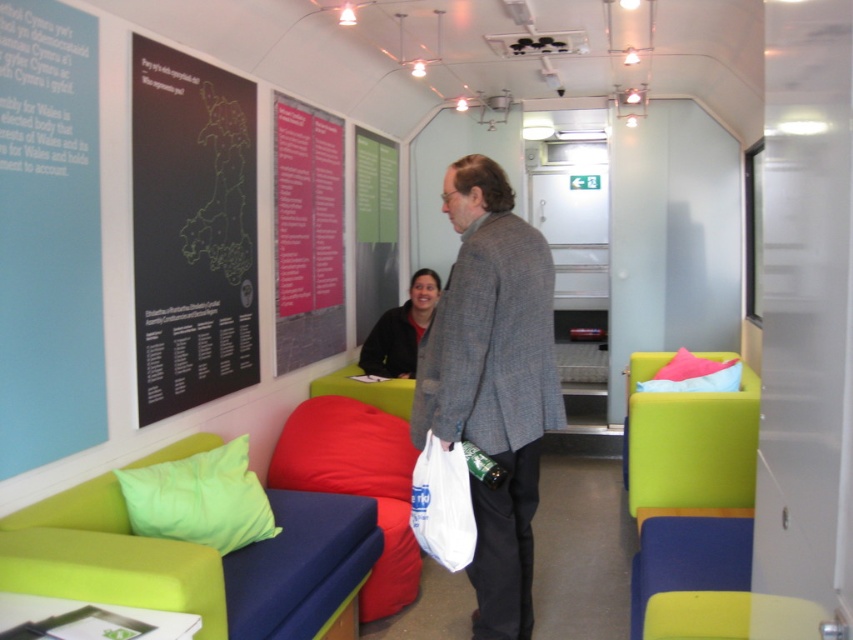
Question: Does pink paper at upper center have a smaller size compared to matte black jacket at center?

Choices:
 (A) yes
 (B) no

Answer: (B)

Question: Estimate the real-world distances between objects in this image. Which object is farther from the red fabric couch at center?

Choices:
 (A) lime green fabric pillow at lower left
 (B) matte blue couch at lower right
 (C) pink paper at upper center

Answer: (B)

Question: Which point is farther to the camera?

Choices:
 (A) (469, 189)
 (B) (631, 513)
 (C) (177, 214)
 (D) (280, 349)

Answer: (D)

Question: Does matte blue couch at lower right have a smaller size compared to white plastic bag at center?

Choices:
 (A) yes
 (B) no

Answer: (B)

Question: Is black matte map at upper left positioned in front of pink paper at upper center?

Choices:
 (A) no
 (B) yes

Answer: (B)

Question: Among these objects, which one is farthest from the camera?

Choices:
 (A) matte black jacket at center
 (B) white plastic bag at center
 (C) matte green couch at center
 (D) matte blue couch at lower right

Answer: (A)